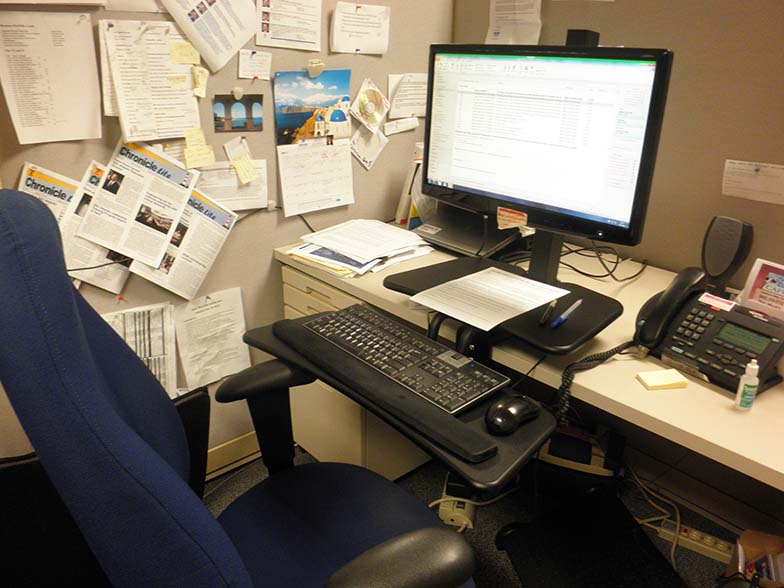
Where is `phone`? This screenshot has width=784, height=588. phone is located at coordinates (728, 290).